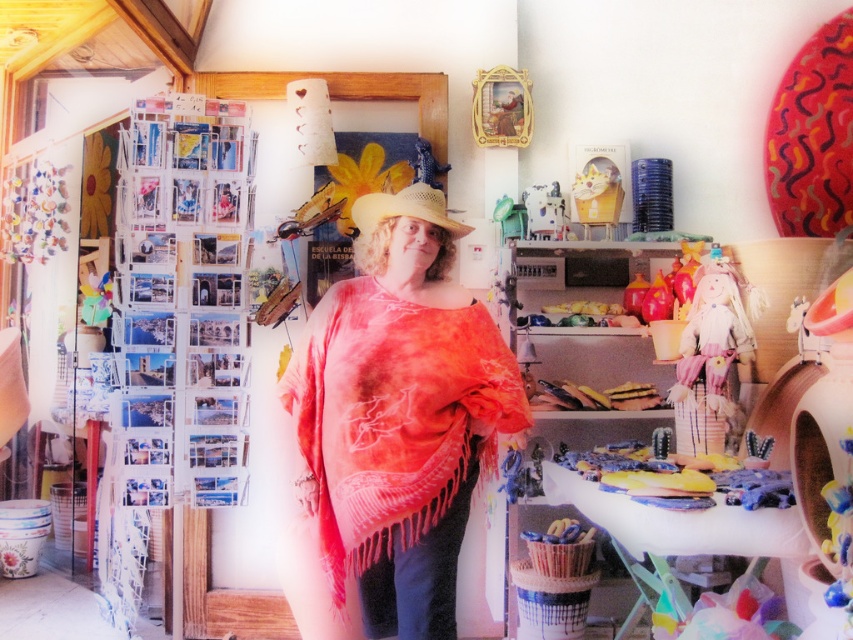
Who is taller, tie-dye fabric poncho at center or woven straw cowboy hat at center?

tie-dye fabric poncho at center

Consider the image. Does tie-dye fabric poncho at center appear on the left side of woven straw cowboy hat at center?

Indeed, tie-dye fabric poncho at center is positioned on the left side of woven straw cowboy hat at center.

What do you see at coordinates (393, 422) in the screenshot? This screenshot has height=640, width=853. I see `tie-dye fabric poncho at center` at bounding box center [393, 422].

Find the location of a particular element. This screenshot has height=640, width=853. tie-dye fabric poncho at center is located at coordinates (393, 422).